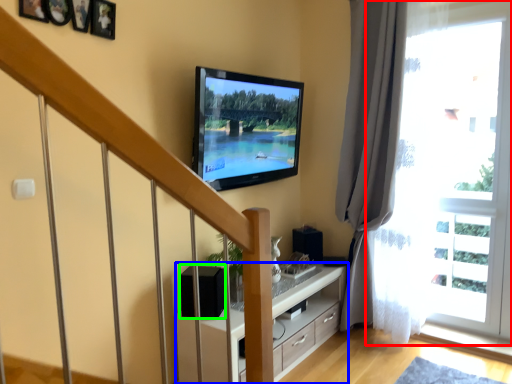
Question: Estimate the real-world distances between objects in this image. Which object is farther from window (highlighted by a red box), cabinetry (highlighted by a blue box) or speaker (highlighted by a green box)?

Choices:
 (A) cabinetry
 (B) speaker

Answer: (B)